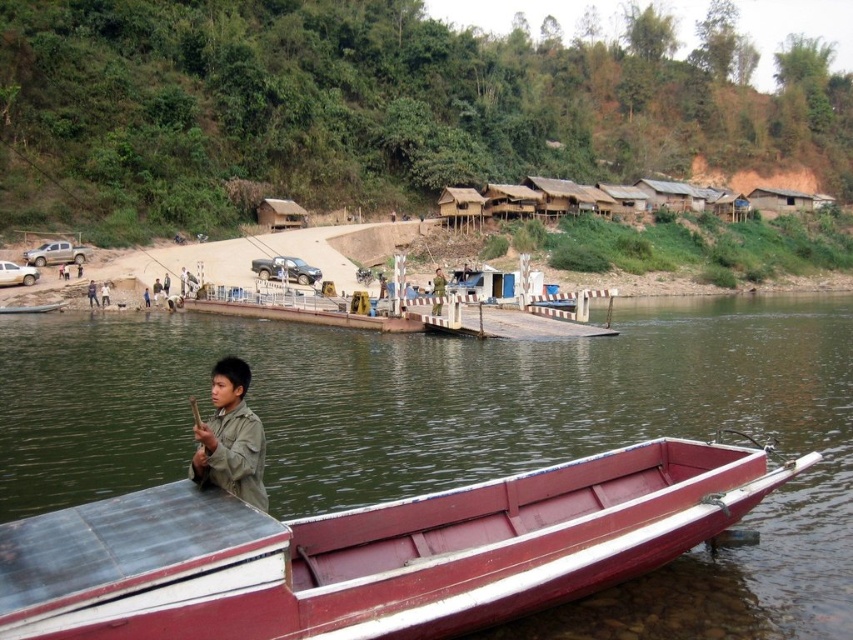
Question: Which object is closer to the camera taking this photo?

Choices:
 (A) green matte shirt at lower left
 (B) smooth red wood boat at lower center

Answer: (B)

Question: Does smooth red wood boat at lower center appear on the right side of green matte shirt at lower left?

Choices:
 (A) no
 (B) yes

Answer: (B)

Question: Which point is closer to the camera taking this photo?

Choices:
 (A) (503, 588)
 (B) (242, 410)

Answer: (A)

Question: Does smooth red wood boat at lower center have a greater width compared to green matte shirt at lower left?

Choices:
 (A) no
 (B) yes

Answer: (B)

Question: Can you confirm if smooth red wood boat at lower center is bigger than green matte shirt at lower left?

Choices:
 (A) no
 (B) yes

Answer: (A)